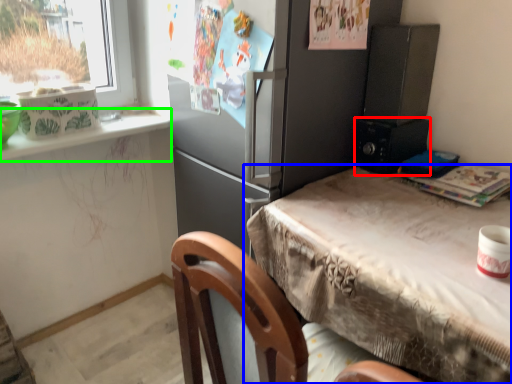
Question: Which object is the closest to the appliance (highlighted by a red box)? Choose among these: table (highlighted by a blue box) or window sill (highlighted by a green box).

Choices:
 (A) table
 (B) window sill

Answer: (A)